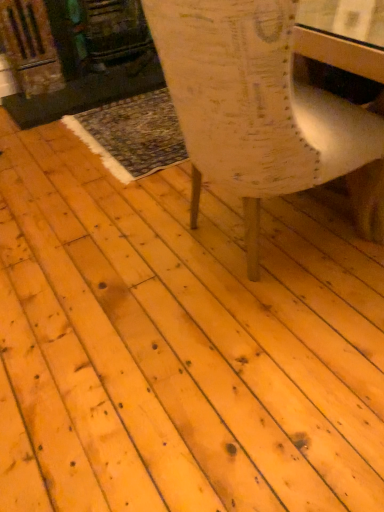
In order to click on white distressed wood chair at center in this screenshot , I will do `click(261, 112)`.

The image size is (384, 512). What do you see at coordinates (261, 112) in the screenshot? I see `white distressed wood chair at center` at bounding box center [261, 112].

Where is `white distressed wood chair at center`? This screenshot has width=384, height=512. white distressed wood chair at center is located at coordinates (261, 112).